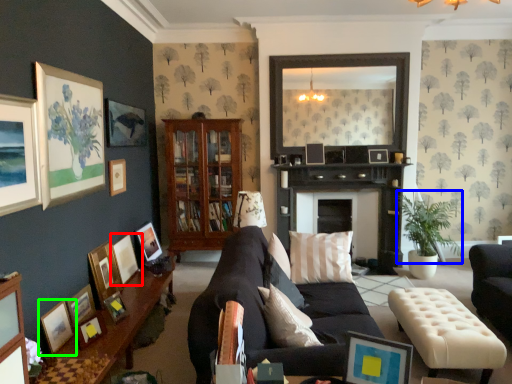
Question: Which object is the farthest from picture frame (highlighted by a red box)? Choose among these: plant (highlighted by a blue box) or picture frame (highlighted by a green box).

Choices:
 (A) plant
 (B) picture frame

Answer: (A)